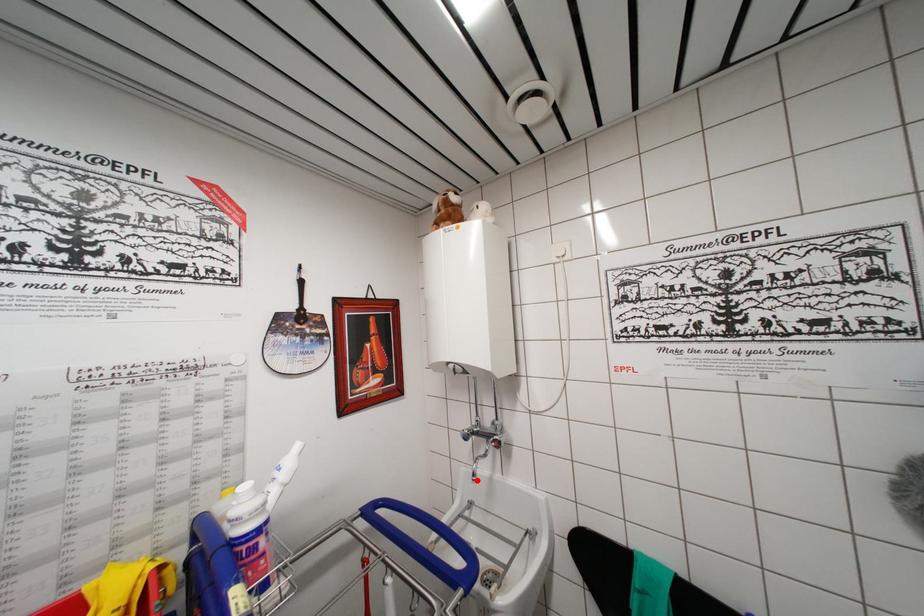
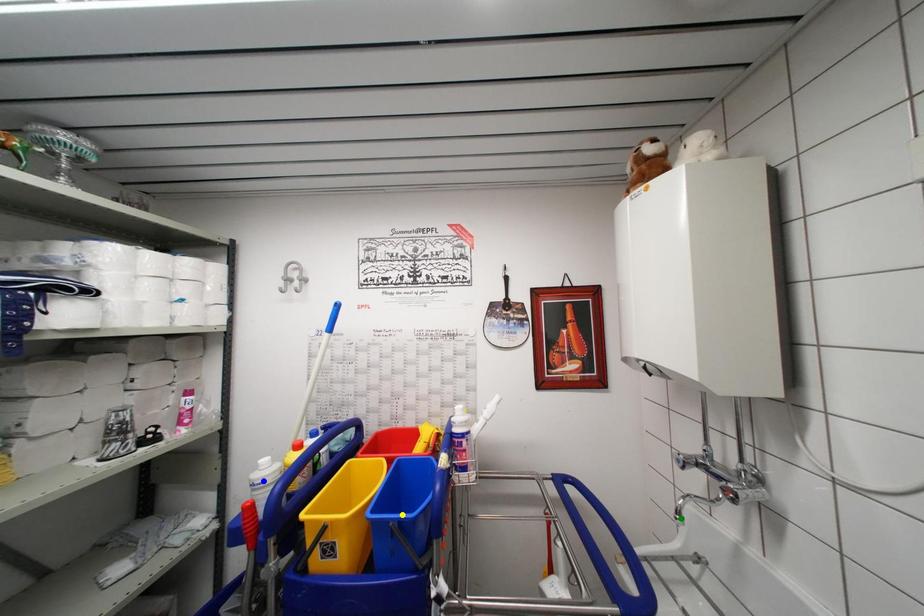
Question: I am providing you with two images of the same scene from different viewpoints. A red point is marked on the first image. You are given multiple points on the second image. Which point in image 2 is actually the same real-world point as the red point in image 1?

Choices:
 (A) green point
 (B) yellow point
 (C) blue point

Answer: (A)